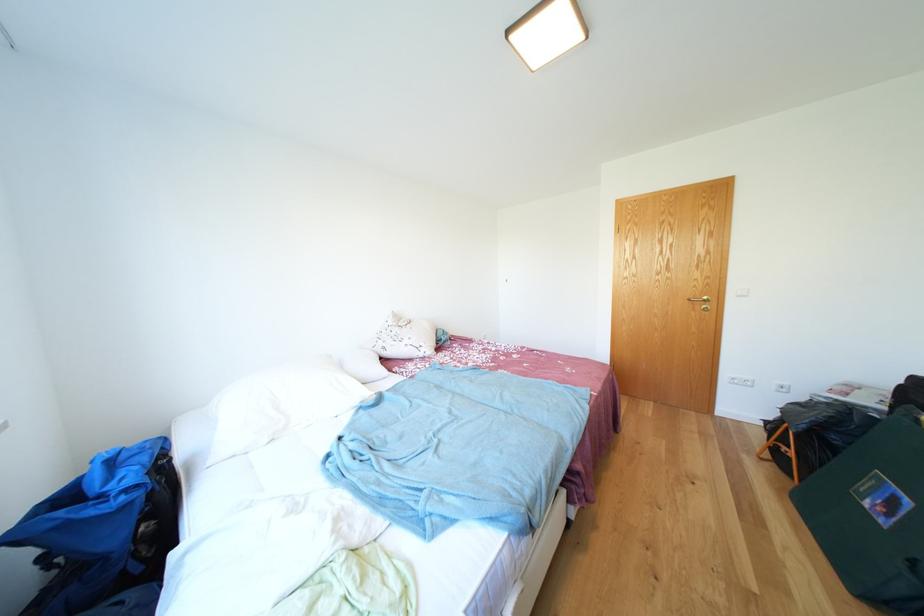
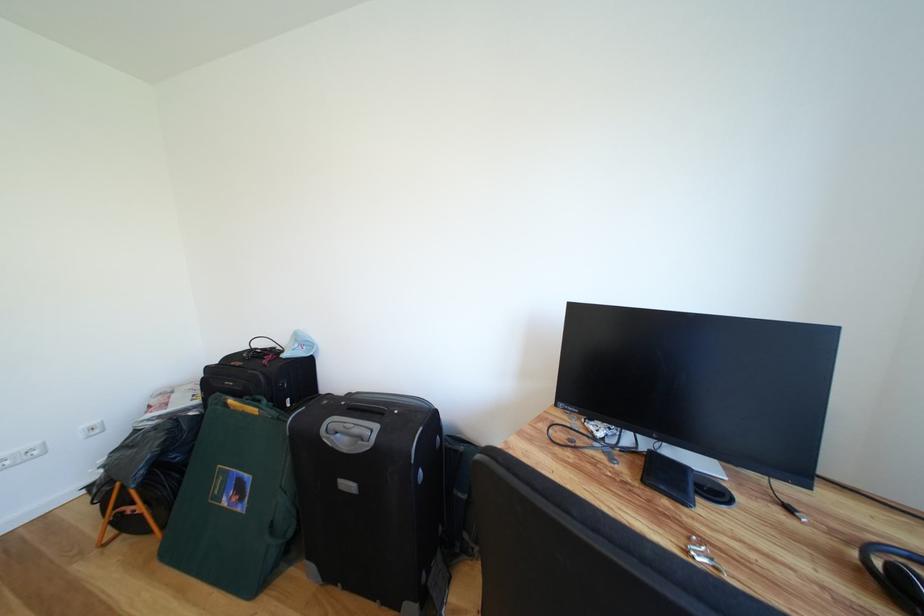
In the second image, find the point that corresponds to point 876,508 in the first image.

(234, 506)